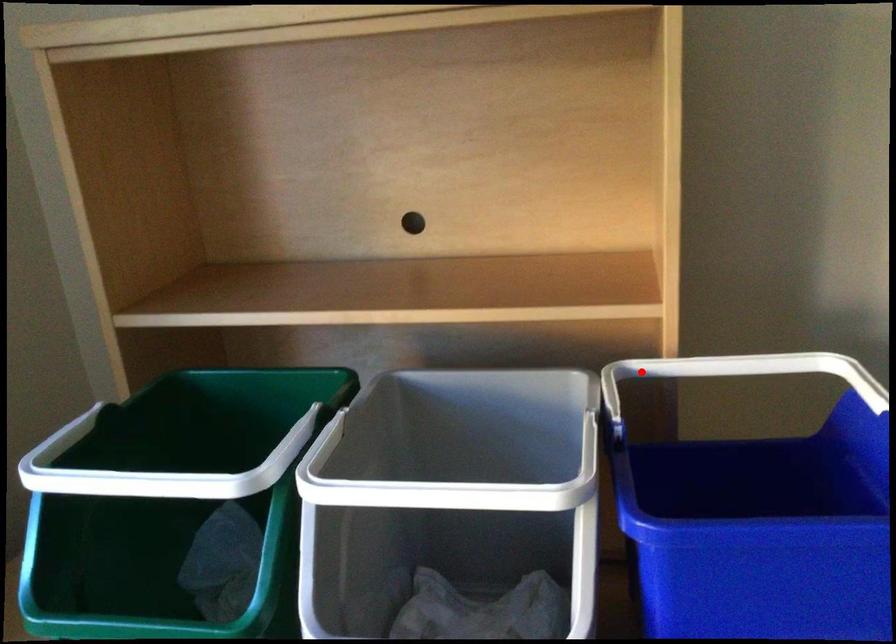
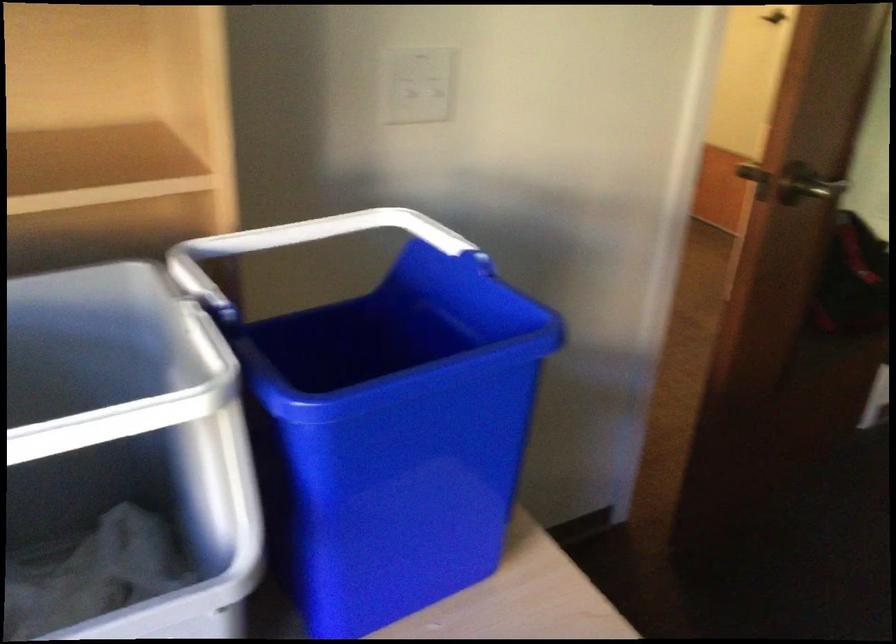
Find the pixel in the second image that matches the highlighted location in the first image.

(213, 257)